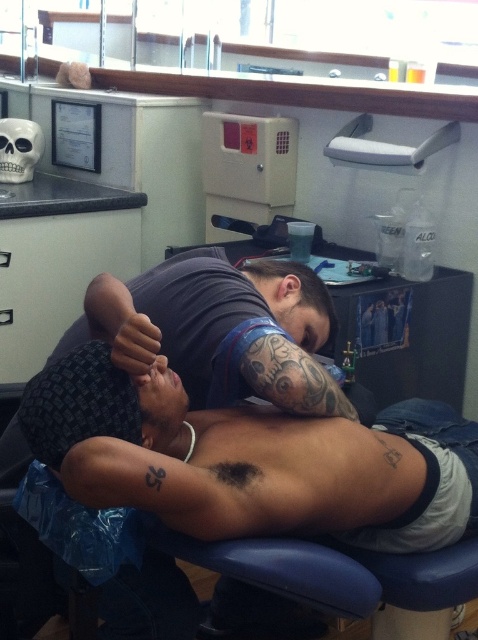
Between dark skin tattooed arm at center and black ink tattoo at lower left, which one is positioned lower?

black ink tattoo at lower left is below.

Which is in front, point (115, 358) or point (148, 480)?

Point (148, 480)

What do you see at coordinates (121, 326) in the screenshot? I see `dark skin tattooed arm at center` at bounding box center [121, 326].

The image size is (478, 640). I want to click on dark skin tattooed arm at center, so click(x=121, y=326).

Is black skin muscle at center positioned behind black ink tattoo at center?

No, black skin muscle at center is in front of black ink tattoo at center.

Which is behind, point (404, 499) or point (258, 472)?

The point (404, 499) is behind.

Between point (217, 529) and point (231, 468), which one is positioned in front?

Point (217, 529) is in front.

What are the coordinates of `black skin muscle at center` in the screenshot? It's located at (294, 474).

Does black skin muscle at center have a smaller size compared to black ink tattoo at lower left?

Actually, black skin muscle at center might be larger than black ink tattoo at lower left.

The height and width of the screenshot is (640, 478). Describe the element at coordinates (294, 474) in the screenshot. I see `black skin muscle at center` at that location.

The width and height of the screenshot is (478, 640). I want to click on black skin muscle at center, so click(x=294, y=474).